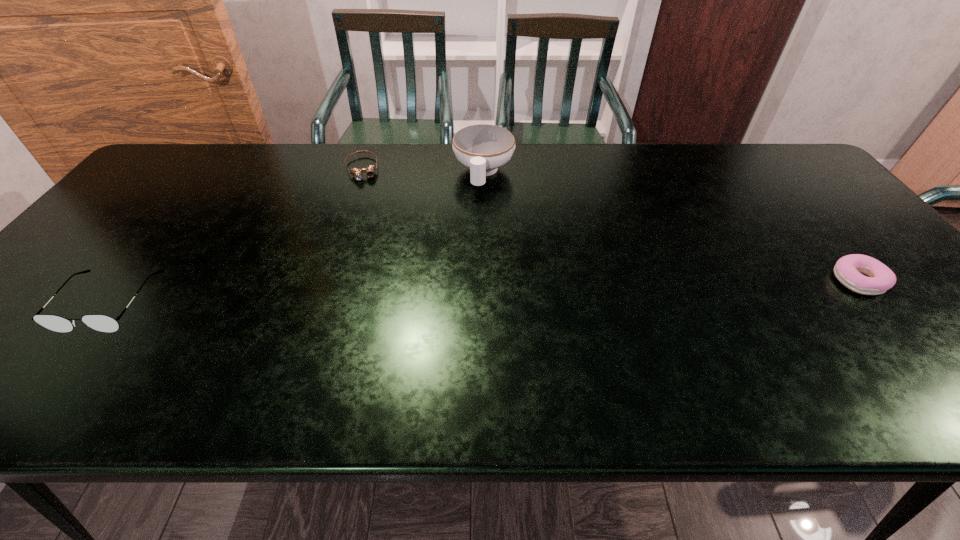
Where is `object positioned at the right edge`? The width and height of the screenshot is (960, 540). object positioned at the right edge is located at coordinates (848, 269).

Where is `object at the near left corner`? The height and width of the screenshot is (540, 960). object at the near left corner is located at coordinates (103, 323).

At what (x,y) coordinates should I click in order to perform the action: click on vacant region at the far edge of the desktop. Please return your answer as a coordinate pair (x, y). Looking at the image, I should click on (561, 181).

I want to click on free space at the near edge, so click(x=614, y=359).

At what (x,y) coordinates should I click in order to perform the action: click on vacant space at the left edge of the desktop. Please return your answer as a coordinate pair (x, y). This screenshot has width=960, height=540. Looking at the image, I should click on (42, 300).

Locate an element on the screen. This screenshot has height=540, width=960. free space at the far left corner of the desktop is located at coordinates click(179, 142).

This screenshot has height=540, width=960. I want to click on vacant region between the chinaware and the leftmost object, so click(297, 238).

What are the coordinates of `vacant area between the second shortest object and the leftmost object` in the screenshot? It's located at (484, 292).

Where is `empty space that is in between the pastry and the third object from left to right`? This screenshot has width=960, height=540. empty space that is in between the pastry and the third object from left to right is located at coordinates (671, 227).

You are a GUI agent. You are given a task and a screenshot of the screen. Output one action in this format:
    pyautogui.click(x=<x>, y=<y>)
    Task: Click on the free space between the pastry and the chinaware
    This screenshot has width=960, height=540.
    Given the screenshot: What is the action you would take?
    pyautogui.click(x=671, y=227)